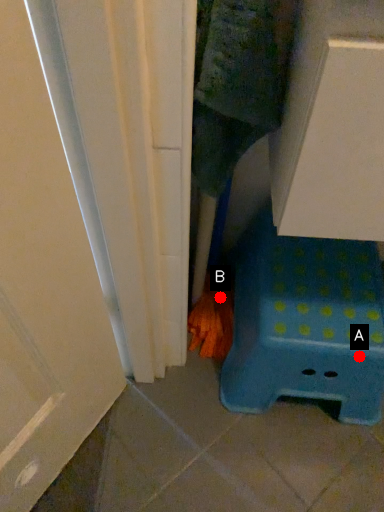
Question: Two points are circled on the image, labeled by A and B beside each circle. Which point is closer to the camera taking this photo?

Choices:
 (A) A is closer
 (B) B is closer

Answer: (A)